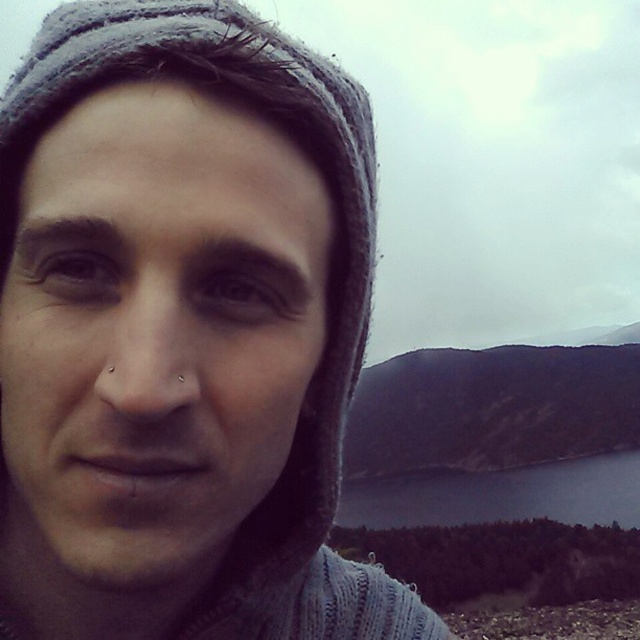
Looking at this image, you are a photographer trying to capture the scene. You notice the matte gray knit cap at upper left and dark blue water at lower center. Which object is shorter in height?

The matte gray knit cap at upper left is not as tall as the dark blue water at lower center, so the matte gray knit cap at upper left is shorter in height.

Consider the image. You are a photographer trying to capture the scenic landscape in the background of the image. You notice a point at coordinates (154, 333) that might be obstructing your view. Can you determine if this point is part of the person wearing the knitted hooded garment or the background landscape?

The point at coordinates (154, 333) corresponds to the matte gray knit cap at upper left, which is part of the person wearing the knitted hooded garment, so it is obstructing your view.